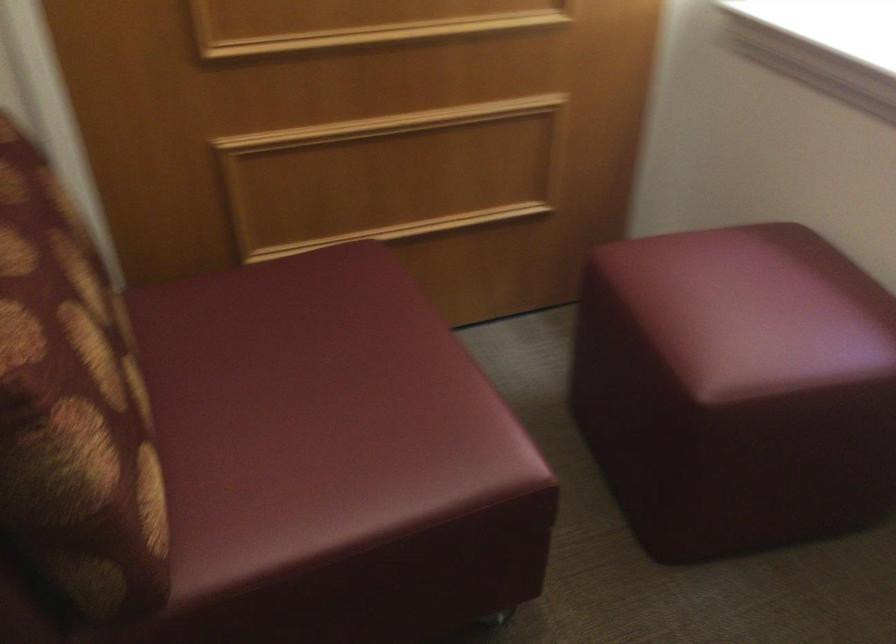
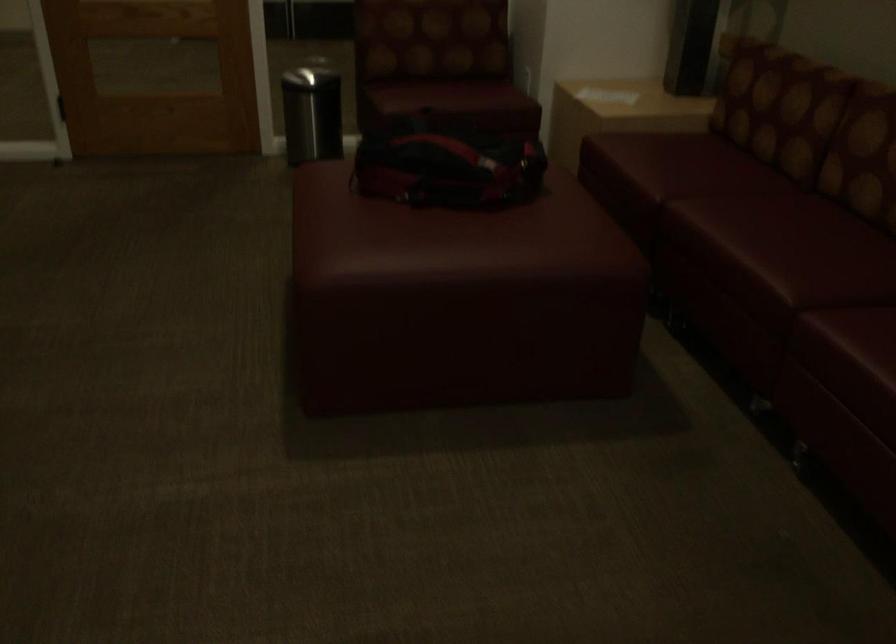
Based on the continuous images, in which direction is the camera rotating?

The camera's rotation is toward left-down.